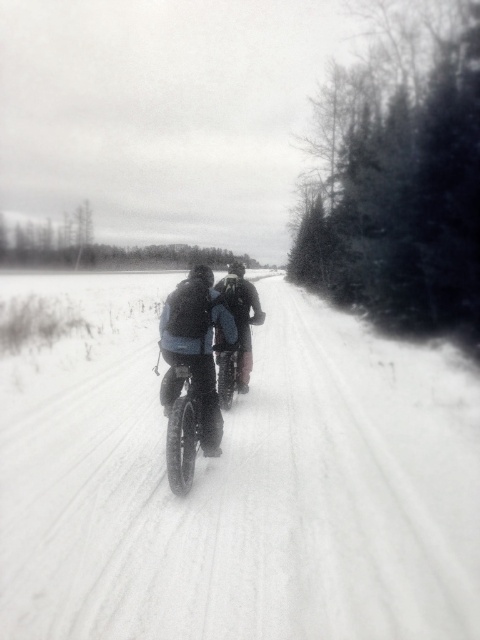
Image resolution: width=480 pixels, height=640 pixels. Identify the location of dark gray fabric jacket at center. (195, 348).

Is point (179, 304) positioned before point (244, 360)?

Yes.

Where is `dark gray fabric jacket at center`? dark gray fabric jacket at center is located at coordinates (195, 348).

Which is above, white fluffy snow at center or dark gray fabric jacket at center?

Positioned higher is dark gray fabric jacket at center.

Does point (374, 397) lie in front of point (166, 349)?

No, (374, 397) is behind (166, 349).

Between point (336, 401) and point (207, 428), which one is positioned behind?

Point (336, 401)

Find the location of a particular element. The width and height of the screenshot is (480, 640). white fluffy snow at center is located at coordinates click(x=251, y=497).

Who is lower down, white fluffy snow at center or shiny black tire at center?

white fluffy snow at center is lower down.

Is point (82, 464) farther from viewer compared to point (202, 404)?

Yes, it is.

The width and height of the screenshot is (480, 640). What are the coordinates of `white fluffy snow at center` in the screenshot? It's located at (251, 497).